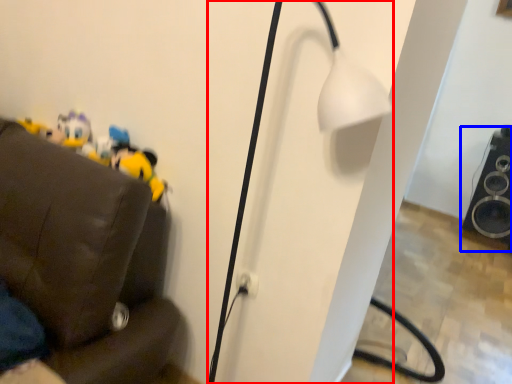
Question: Among these objects, which one is farthest to the camera, lamp (highlighted by a red box) or speaker (highlighted by a blue box)?

Choices:
 (A) lamp
 (B) speaker

Answer: (B)